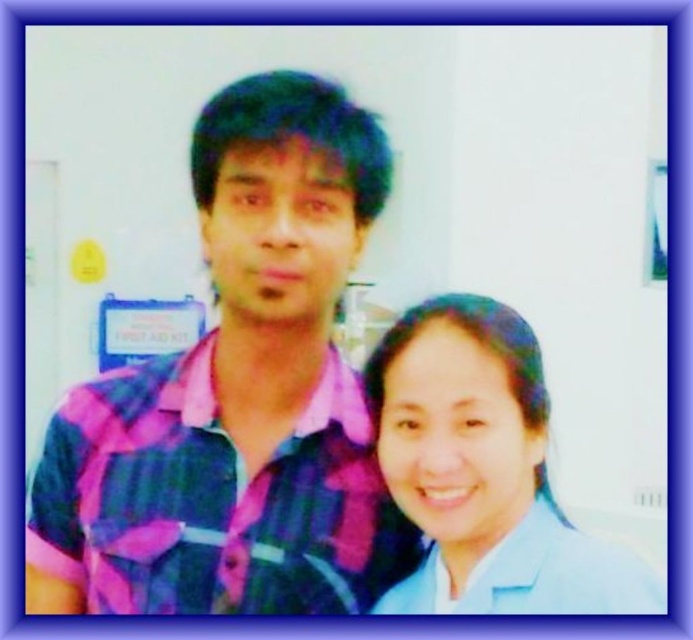
Question: Does pink plaid shirt at center appear on the left side of blue fabric shirt at lower right?

Choices:
 (A) no
 (B) yes

Answer: (B)

Question: Which object is closer to the camera taking this photo?

Choices:
 (A) pink plaid shirt at center
 (B) blue fabric shirt at lower right

Answer: (B)

Question: Is pink plaid shirt at center to the left of blue fabric shirt at lower right from the viewer's perspective?

Choices:
 (A) no
 (B) yes

Answer: (B)

Question: In this image, where is pink plaid shirt at center located relative to blue fabric shirt at lower right?

Choices:
 (A) left
 (B) right

Answer: (A)

Question: Which point is farther from the camera taking this photo?

Choices:
 (A) (568, 604)
 (B) (238, 461)

Answer: (B)